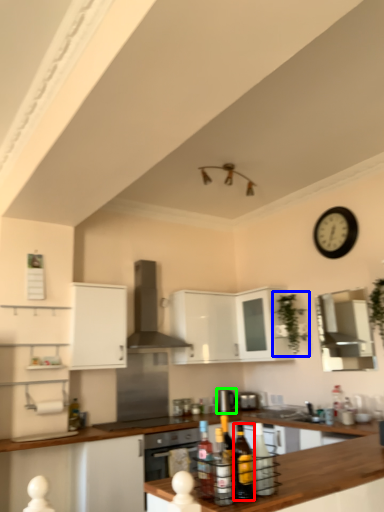
Question: Considering the real-world distances, which object is closest to bottle (highlighted by a red box)? plant (highlighted by a blue box) or appliance (highlighted by a green box).

Choices:
 (A) plant
 (B) appliance

Answer: (A)